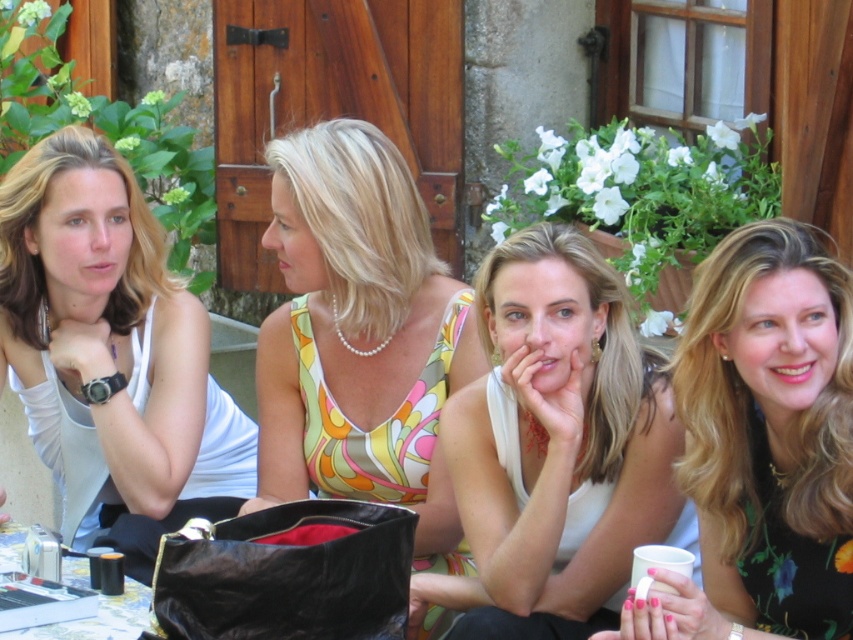
You are a photographer trying to capture a candid shot of the scene. You notice the white matte tank top at left and the metallic silver cup at lower left. Which object is positioned more to the left side of the frame?

The white matte tank top at left is positioned more to the left side of the frame than the metallic silver cup at lower left.

You are standing at the viewpoint of the image and want to walk towards the point at the bottom right corner. Which point, point (x=548, y=634) or point (x=76, y=564), is closer to your path?

Point (x=76, y=564) is closer to your path because it is located at the bottom right corner, which is the direction you are walking towards.